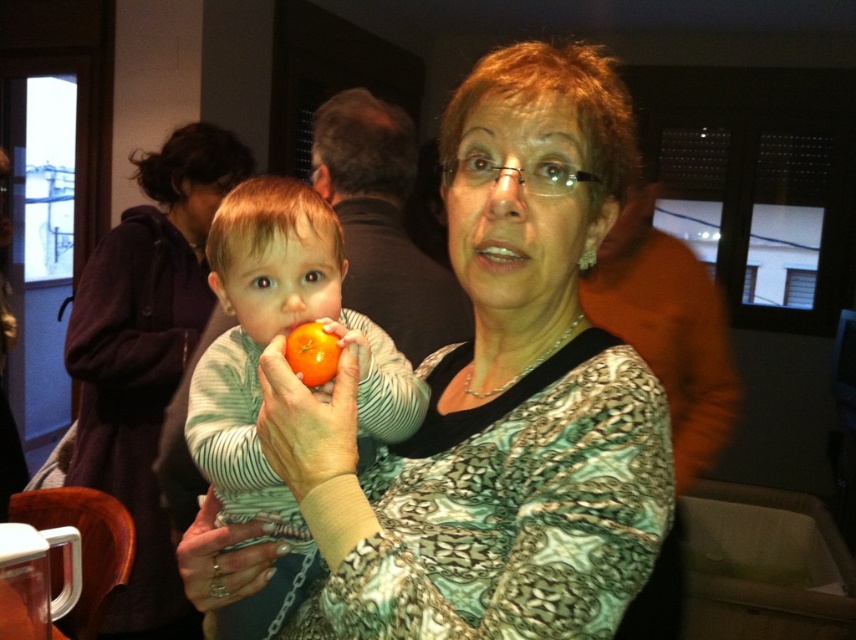
Who is higher up, matte orange at center or matte orange tomato at center?

Positioned higher is matte orange tomato at center.

Between point (289, 458) and point (316, 337), which one is positioned in front?

Point (289, 458)

The height and width of the screenshot is (640, 856). What are the coordinates of `matte orange at center` in the screenshot? It's located at (311, 419).

Does smooth orange at center have a lesser width compared to matte orange at center?

No, smooth orange at center is not thinner than matte orange at center.

Between smooth orange at center and matte orange at center, which one appears on the left side from the viewer's perspective?

Positioned to the left is smooth orange at center.

The height and width of the screenshot is (640, 856). I want to click on smooth orange at center, so (x=259, y=378).

Looking at this image, can you confirm if smooth orange at center is shorter than metallic ring at center?

Incorrect, smooth orange at center's height does not fall short of metallic ring at center's.

This screenshot has width=856, height=640. Describe the element at coordinates (259, 378) in the screenshot. I see `smooth orange at center` at that location.

Is point (242, 332) positioned behind point (242, 579)?

Yes, point (242, 332) is farther from viewer.

Find the location of `smooth orange at center`. smooth orange at center is located at coordinates (259, 378).